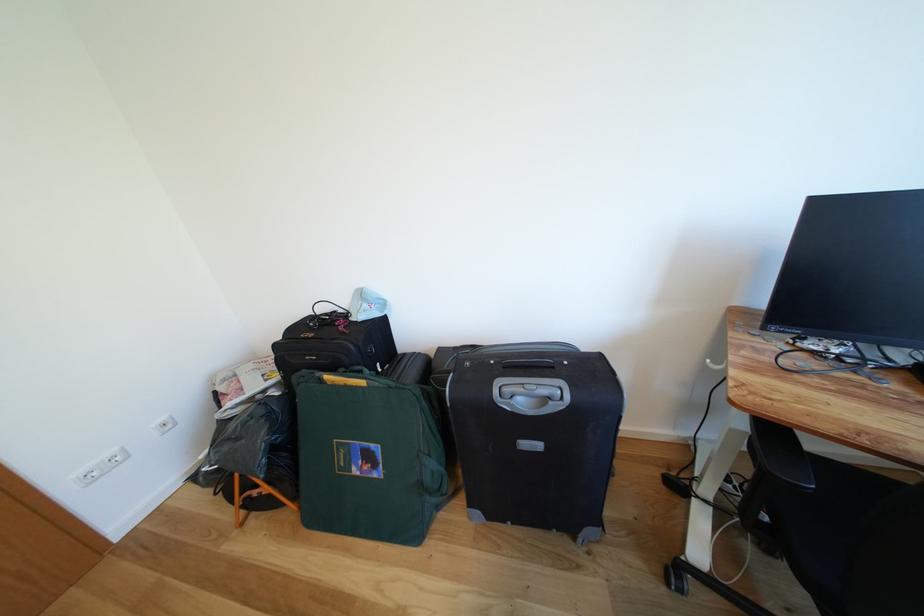
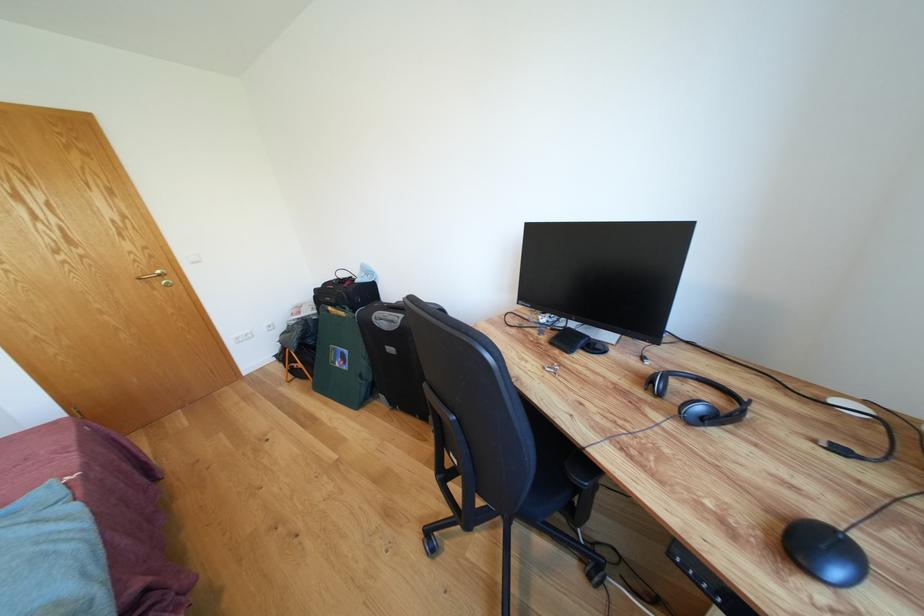
In the second image, find the point that corresponds to (553,395) in the first image.

(398, 322)